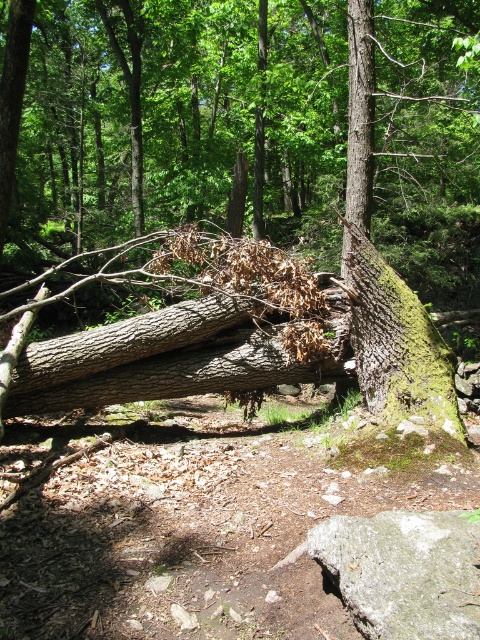
Question: Is gray rough rock at lower right thinner than green mossy tree trunk at center?

Choices:
 (A) yes
 (B) no

Answer: (A)

Question: Is gray rough rock at lower right thinner than green mossy tree trunk at center?

Choices:
 (A) yes
 (B) no

Answer: (A)

Question: Is gray rough rock at lower right positioned at the back of green mossy tree trunk at center?

Choices:
 (A) yes
 (B) no

Answer: (B)